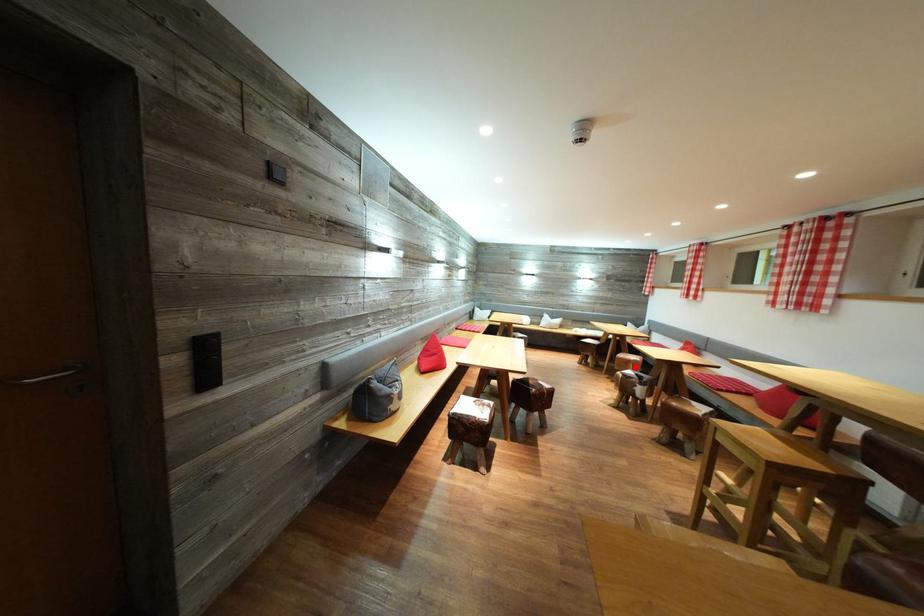
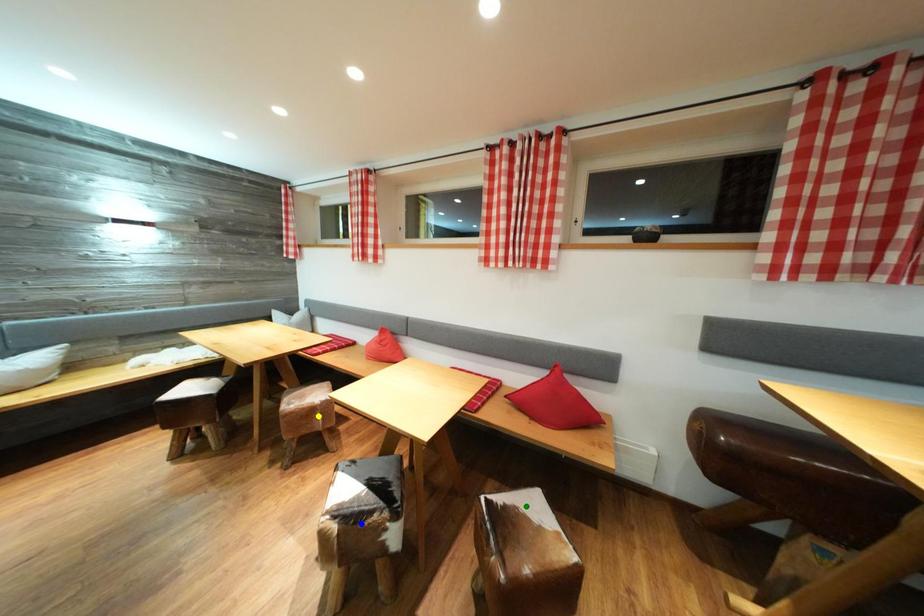
Question: I am providing you with two images of the same scene from different viewpoints. A red point is marked on the first image. You are given multiple points on the second image. Which point in image 2 is actually the same real-world point as the red point in image 1?

Choices:
 (A) yellow point
 (B) blue point
 (C) green point

Answer: (A)